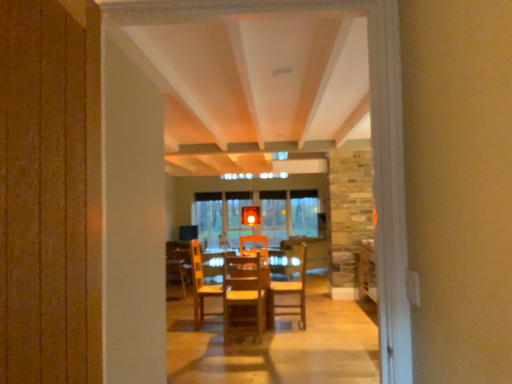
Where is `free space to the back side of wooden chair at center, the 2th chair positioned from the right`? free space to the back side of wooden chair at center, the 2th chair positioned from the right is located at coordinates (240, 322).